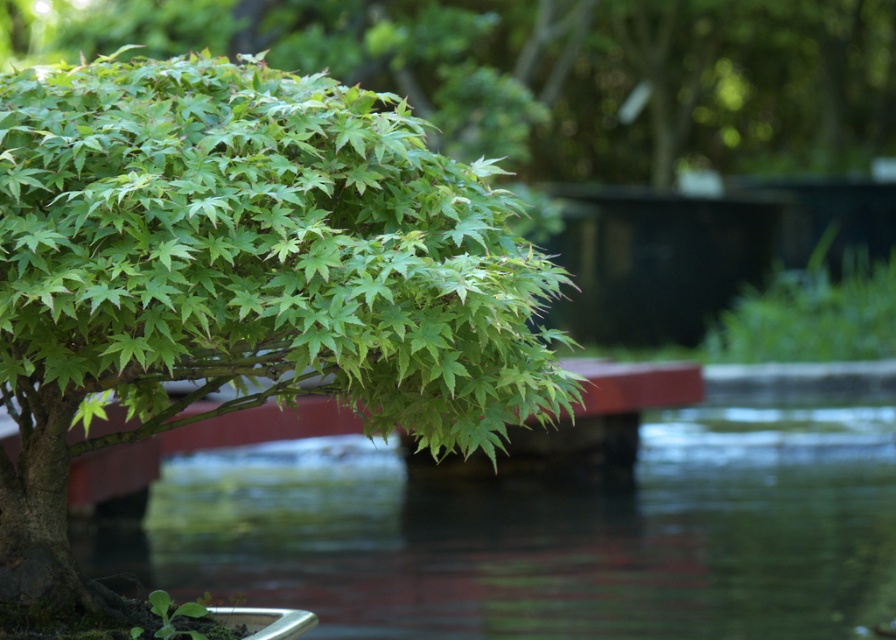
Is green leafy tree at left below transparent water at lower center?

No.

How far apart are green leafy tree at left and transparent water at lower center?

green leafy tree at left is 19.91 feet away from transparent water at lower center.

The height and width of the screenshot is (640, 896). I want to click on green leafy tree at left, so click(x=240, y=278).